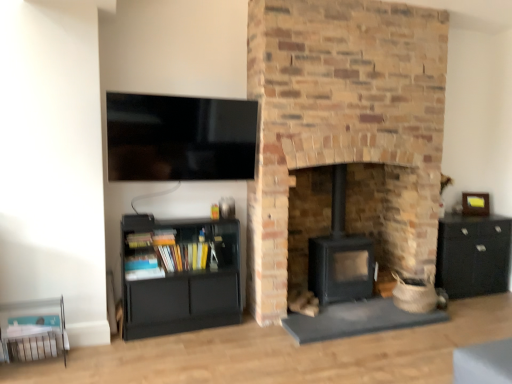
Question: Is matte black bookshelf at lower left touching wooden picture frame at right?

Choices:
 (A) no
 (B) yes

Answer: (A)

Question: Is the depth of matte black bookshelf at lower left less than that of wooden picture frame at right?

Choices:
 (A) yes
 (B) no

Answer: (A)

Question: Is wooden picture frame at right inside matte black bookshelf at lower left?

Choices:
 (A) yes
 (B) no

Answer: (B)

Question: Considering the relative sizes of matte black bookshelf at lower left and wooden picture frame at right in the image provided, is matte black bookshelf at lower left thinner than wooden picture frame at right?

Choices:
 (A) yes
 (B) no

Answer: (B)

Question: From a real-world perspective, is matte black bookshelf at lower left below wooden picture frame at right?

Choices:
 (A) no
 (B) yes

Answer: (B)

Question: Is flat screen tv at upper left spatially inside matte black bookshelf at lower left, or outside of it?

Choices:
 (A) outside
 (B) inside

Answer: (A)

Question: From the image's perspective, is flat screen tv at upper left located above or below matte black bookshelf at lower left?

Choices:
 (A) above
 (B) below

Answer: (A)

Question: Considering their positions, is flat screen tv at upper left located in front of or behind matte black bookshelf at lower left?

Choices:
 (A) behind
 (B) front

Answer: (B)

Question: Visually, is flat screen tv at upper left positioned to the left or to the right of matte black bookshelf at lower left?

Choices:
 (A) right
 (B) left

Answer: (A)

Question: Considering their positions, is wooden picture frame at right located in front of or behind black matte cabinet at right?

Choices:
 (A) front
 (B) behind

Answer: (B)

Question: From a real-world perspective, is wooden picture frame at right positioned above or below black matte cabinet at right?

Choices:
 (A) above
 (B) below

Answer: (A)

Question: Based on their sizes in the image, would you say wooden picture frame at right is bigger or smaller than black matte cabinet at right?

Choices:
 (A) small
 (B) big

Answer: (A)

Question: From the image's perspective, is wooden picture frame at right positioned above or below black matte cabinet at right?

Choices:
 (A) below
 (B) above

Answer: (B)

Question: From the image's perspective, is black matte wood burning stove at center above or below brick fireplace at center?

Choices:
 (A) below
 (B) above

Answer: (A)

Question: Is black matte wood burning stove at center bigger or smaller than brick fireplace at center?

Choices:
 (A) small
 (B) big

Answer: (A)